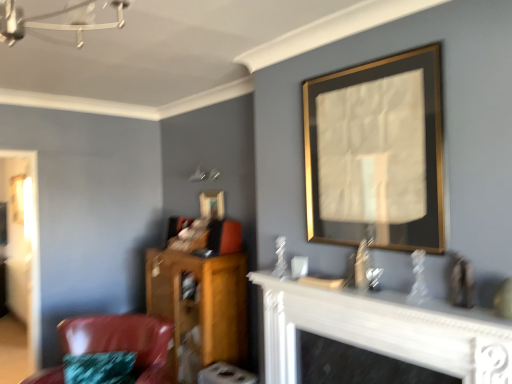
Question: From the image's perspective, is white glossy fireplace at lower center above or below shiny leather chair at lower left?

Choices:
 (A) below
 (B) above

Answer: (B)

Question: Looking at their shapes, would you say white glossy fireplace at lower center is wider or thinner than shiny leather chair at lower left?

Choices:
 (A) thin
 (B) wide

Answer: (A)

Question: Estimate the real-world distances between objects in this image. Which object is farther from the white glossy fireplace at lower center?

Choices:
 (A) gold-framed mirror at upper center, which appears as the first picture frame when viewed from the back
 (B) shiny leather chair at lower left
 (C) gold/metallic picture frame at upper right, which is the second picture frame in back-to-front order
 (D) wooden cabinet at lower left

Answer: (A)

Question: Which is farther from the gold/metallic picture frame at upper right, which is the 1th picture frame from right to left?

Choices:
 (A) gold-framed mirror at upper center, which appears as the first picture frame when viewed from the back
 (B) shiny leather chair at lower left
 (C) wooden cabinet at lower left
 (D) white glossy fireplace at lower center

Answer: (B)